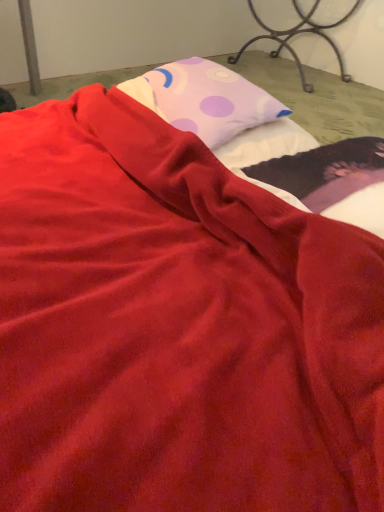
What do you see at coordinates (297, 34) in the screenshot? Image resolution: width=384 pixels, height=512 pixels. I see `metallic wrought iron bed frame at upper right` at bounding box center [297, 34].

The height and width of the screenshot is (512, 384). I want to click on metallic wrought iron bed frame at upper right, so click(x=297, y=34).

In order to face metallic wrought iron bed frame at upper right, should I rotate leftwards or rightwards?

A 13.915 degree turn to the right will do.

Where is `matte pink pillow at upper center`? This screenshot has width=384, height=512. matte pink pillow at upper center is located at coordinates (204, 99).

This screenshot has height=512, width=384. What do you see at coordinates (204, 99) in the screenshot? I see `matte pink pillow at upper center` at bounding box center [204, 99].

At what (x,y) coordinates should I click in order to perform the action: click on metallic wrought iron bed frame at upper right. Please return your answer as a coordinate pair (x, y). Looking at the image, I should click on (297, 34).

Which is more to the right, matte pink pillow at upper center or metallic wrought iron bed frame at upper right?

From the viewer's perspective, metallic wrought iron bed frame at upper right appears more on the right side.

Which object is closer to the camera taking this photo, matte pink pillow at upper center or metallic wrought iron bed frame at upper right?

Positioned in front is matte pink pillow at upper center.

Is point (147, 106) in front of point (243, 51)?

Yes.

From the image's perspective, who appears lower, matte pink pillow at upper center or metallic wrought iron bed frame at upper right?

matte pink pillow at upper center.

From a real-world perspective, is matte pink pillow at upper center below metallic wrought iron bed frame at upper right?

No, from a real-world perspective, matte pink pillow at upper center is not below metallic wrought iron bed frame at upper right.

Does matte pink pillow at upper center have a greater width compared to metallic wrought iron bed frame at upper right?

In fact, matte pink pillow at upper center might be narrower than metallic wrought iron bed frame at upper right.

Does matte pink pillow at upper center have a greater height compared to metallic wrought iron bed frame at upper right?

No, matte pink pillow at upper center is not taller than metallic wrought iron bed frame at upper right.

Is matte pink pillow at upper center smaller than metallic wrought iron bed frame at upper right?

Indeed, matte pink pillow at upper center has a smaller size compared to metallic wrought iron bed frame at upper right.

Would you say matte pink pillow at upper center is inside or outside metallic wrought iron bed frame at upper right?

matte pink pillow at upper center is outside metallic wrought iron bed frame at upper right.

Is there a large distance between matte pink pillow at upper center and metallic wrought iron bed frame at upper right?

matte pink pillow at upper center is far away from metallic wrought iron bed frame at upper right.

Is matte pink pillow at upper center oriented away from metallic wrought iron bed frame at upper right?

That's not correct — matte pink pillow at upper center is not looking away from metallic wrought iron bed frame at upper right.

What's the angular difference between matte pink pillow at upper center and metallic wrought iron bed frame at upper right's facing directions?

88.9 degrees separate the facing orientations of matte pink pillow at upper center and metallic wrought iron bed frame at upper right.

How far apart are matte pink pillow at upper center and metallic wrought iron bed frame at upper right?

4.74 feet.

This screenshot has height=512, width=384. I want to click on pillow that appears below the metallic wrought iron bed frame at upper right (from the image's perspective), so click(x=204, y=99).

Can you confirm if metallic wrought iron bed frame at upper right is positioned to the right of matte pink pillow at upper center?

Yes, metallic wrought iron bed frame at upper right is to the right of matte pink pillow at upper center.

Does metallic wrought iron bed frame at upper right lie behind matte pink pillow at upper center?

Yes, metallic wrought iron bed frame at upper right is behind matte pink pillow at upper center.

Considering the points (333, 44) and (214, 114), which point is behind, point (333, 44) or point (214, 114)?

Point (333, 44)

From the image's perspective, does metallic wrought iron bed frame at upper right appear higher than matte pink pillow at upper center?

Yes.

From a real-world perspective, which is physically above, metallic wrought iron bed frame at upper right or matte pink pillow at upper center?

In real-world perspective, matte pink pillow at upper center is above.

Does metallic wrought iron bed frame at upper right have a lesser width compared to matte pink pillow at upper center?

No.

Consider the image. Considering the sizes of objects metallic wrought iron bed frame at upper right and matte pink pillow at upper center in the image provided, who is taller, metallic wrought iron bed frame at upper right or matte pink pillow at upper center?

Standing taller between the two is metallic wrought iron bed frame at upper right.

Is metallic wrought iron bed frame at upper right smaller than matte pink pillow at upper center?

No.

Would you say matte pink pillow at upper center is part of metallic wrought iron bed frame at upper right's contents?

Definitely not — matte pink pillow at upper center is not inside metallic wrought iron bed frame at upper right.

Is metallic wrought iron bed frame at upper right not close to matte pink pillow at upper center?

Yes, metallic wrought iron bed frame at upper right is far from matte pink pillow at upper center.

Is metallic wrought iron bed frame at upper right oriented away from matte pink pillow at upper center?

metallic wrought iron bed frame at upper right is not turned away from matte pink pillow at upper center.

From the picture: What's the angular difference between metallic wrought iron bed frame at upper right and matte pink pillow at upper center's facing directions?

The angular difference between metallic wrought iron bed frame at upper right and matte pink pillow at upper center is 88.9 degrees.

Measure the distance from metallic wrought iron bed frame at upper right to matte pink pillow at upper center.

metallic wrought iron bed frame at upper right and matte pink pillow at upper center are 1.45 meters apart from each other.

I want to click on furniture located on the right of matte pink pillow at upper center, so click(297, 34).

Where is `furniture behind the matte pink pillow at upper center`? The image size is (384, 512). furniture behind the matte pink pillow at upper center is located at coordinates (297, 34).

Locate an element on the screen. The width and height of the screenshot is (384, 512). furniture directly beneath the matte pink pillow at upper center (from a real-world perspective) is located at coordinates (297, 34).